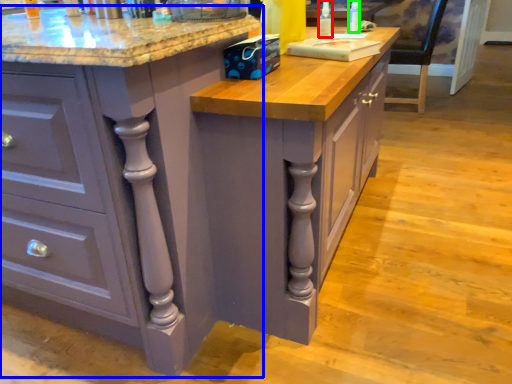
Question: Which is farther away from bottle (highlighted by a red box)? cabinetry (highlighted by a blue box) or bottle (highlighted by a green box)?

Choices:
 (A) cabinetry
 (B) bottle

Answer: (A)